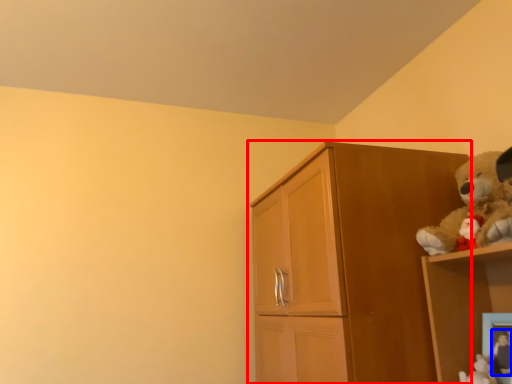
Question: Which object appears closest to the camera in this image, cupboard (highlighted by a red box) or toy (highlighted by a blue box)?

Choices:
 (A) cupboard
 (B) toy

Answer: (B)